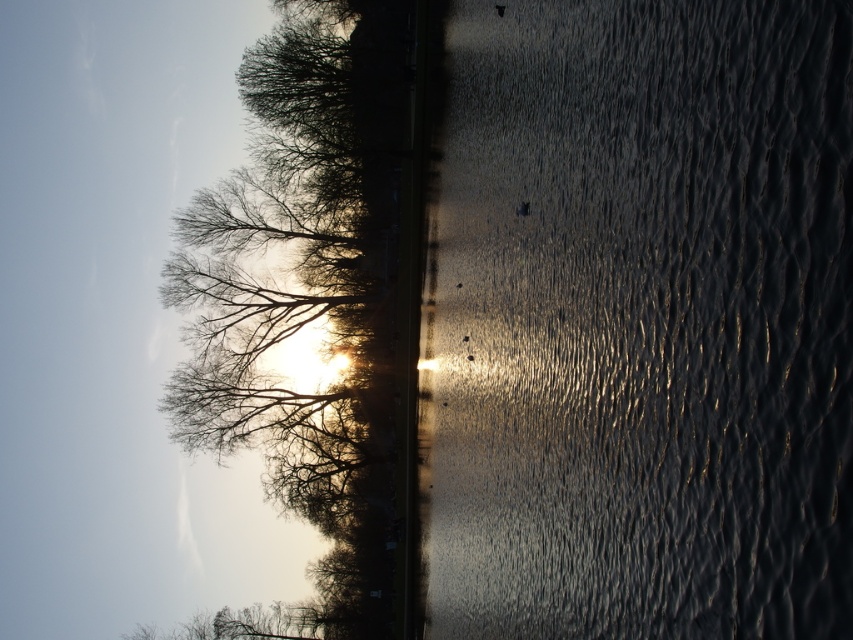
Question: Is silvery branches at upper left above bare branches at lower left?

Choices:
 (A) yes
 (B) no

Answer: (A)

Question: Which point is closer to the camera taking this photo?

Choices:
 (A) (300, 632)
 (B) (213, 412)

Answer: (B)

Question: Does silvery branches at upper left have a larger size compared to bare branches at lower left?

Choices:
 (A) no
 (B) yes

Answer: (B)

Question: Which point is closer to the camera taking this photo?

Choices:
 (A) (228, 611)
 (B) (254, 426)

Answer: (B)

Question: Can you confirm if silvery branches at upper left is wider than bare branches at lower left?

Choices:
 (A) no
 (B) yes

Answer: (A)